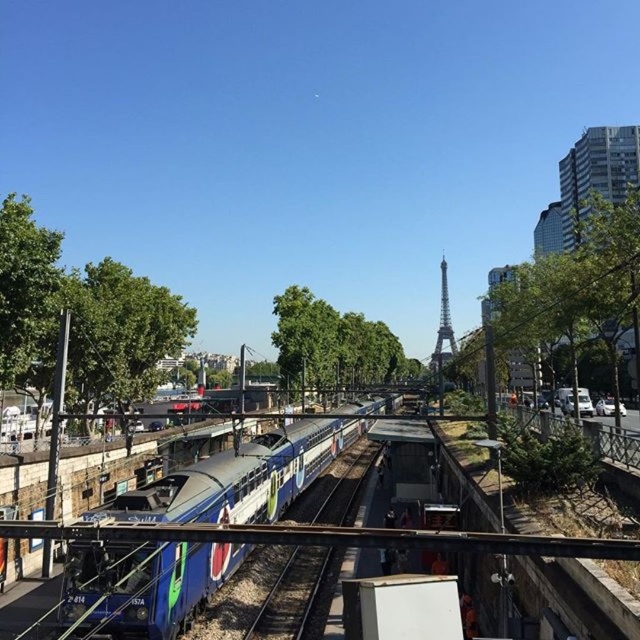
Question: Does blue metallic train track at center appear under metallic silver tower at center?

Choices:
 (A) yes
 (B) no

Answer: (A)

Question: From the image, what is the correct spatial relationship of blue metallic train track at center in relation to metallic silver tower at center?

Choices:
 (A) above
 (B) below

Answer: (B)

Question: Does blue metallic train track at center appear on the left side of metallic silver tower at center?

Choices:
 (A) yes
 (B) no

Answer: (A)

Question: Which point is closer to the camera?

Choices:
 (A) metallic silver tower at center
 (B) blue metallic train track at center

Answer: (B)

Question: Which point is farther to the camera?

Choices:
 (A) metallic silver tower at center
 (B) blue metallic train track at center

Answer: (A)

Question: Which of these objects is positioned closest to the blue metallic train track at center?

Choices:
 (A) metallic silver tower at center
 (B) blue glossy train at center

Answer: (B)